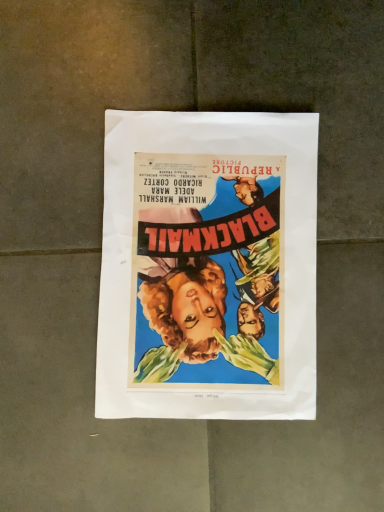
Where is `vibrant paper poster at center`? This screenshot has height=512, width=384. vibrant paper poster at center is located at coordinates (208, 266).

The image size is (384, 512). What do you see at coordinates (208, 266) in the screenshot?
I see `vibrant paper poster at center` at bounding box center [208, 266].

Find the location of a particular element. This screenshot has width=384, height=512. vibrant paper poster at center is located at coordinates (208, 266).